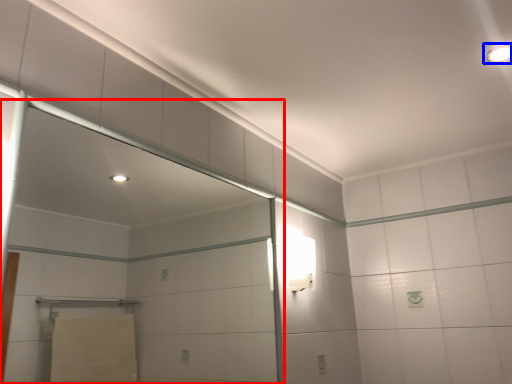
Question: Among these objects, which one is nearest to the camera, screen door (highlighted by a red box) or light fixture (highlighted by a blue box)?

Choices:
 (A) screen door
 (B) light fixture

Answer: (A)